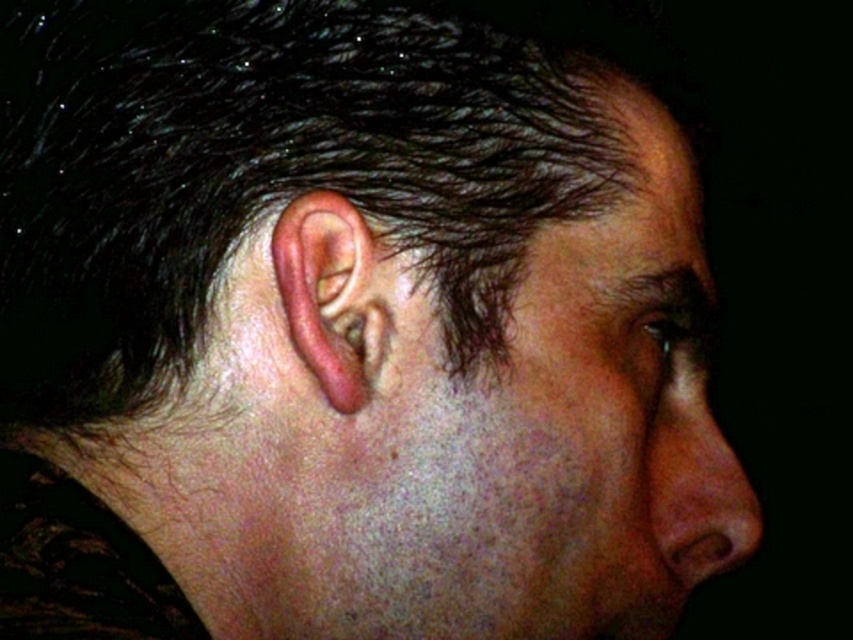
Which is more to the left, pink flesh-colored ear at center or matte pink nose at right?

From the viewer's perspective, pink flesh-colored ear at center appears more on the left side.

Does pink flesh-colored ear at center have a lesser height compared to matte pink nose at right?

Yes.

Find the location of a particular element. The height and width of the screenshot is (640, 853). pink flesh-colored ear at center is located at coordinates pyautogui.click(x=329, y=296).